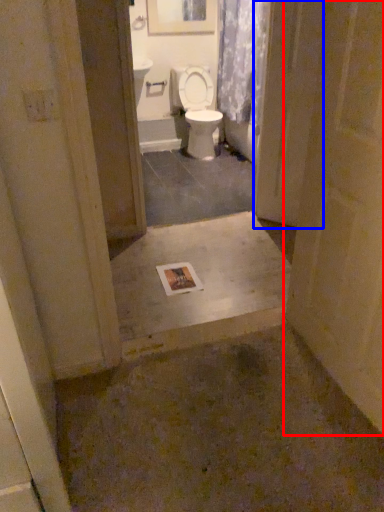
Question: Which object appears closest to the camera in this image, door (highlighted by a red box) or screen door (highlighted by a blue box)?

Choices:
 (A) door
 (B) screen door

Answer: (A)